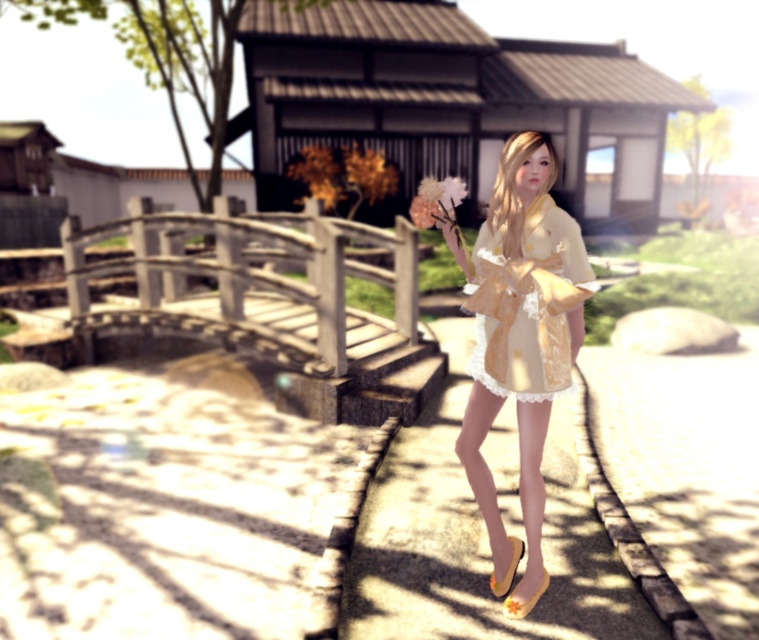
Between point (468, 440) and point (128, 324), which one is positioned behind?

The point (128, 324) is more distant.

Between matte yellow kimono at center and wooden bridge at left, which one has more height?

With more height is matte yellow kimono at center.

This screenshot has height=640, width=759. I want to click on matte yellow kimono at center, so click(x=520, y=342).

The width and height of the screenshot is (759, 640). Identify the location of matte yellow kimono at center. (520, 342).

Who is positioned more to the right, wooden bridge at left or matte pink flower at center?

Positioned to the right is matte pink flower at center.

Can you confirm if wooden bridge at left is thinner than matte pink flower at center?

No.

The height and width of the screenshot is (640, 759). Identify the location of wooden bridge at left. (244, 276).

Does point (284, 282) come in front of point (561, 264)?

No, (284, 282) is further to viewer.

Who is more forward, [175,324] or [476,378]?

Point [476,378] is more forward.

Where is `wooden bridge at left`? wooden bridge at left is located at coordinates (244, 276).